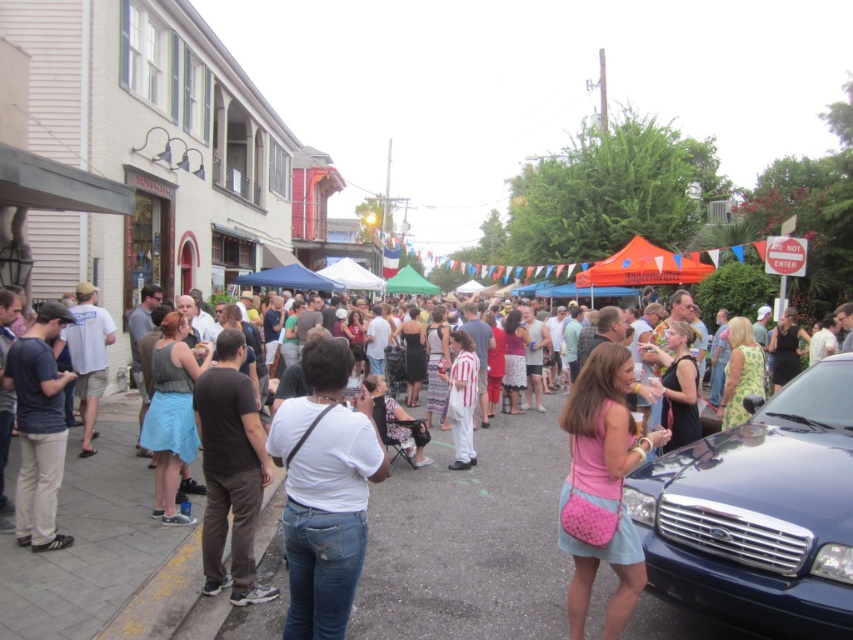
You are a pedestrian trying to cross the street from the left side where you are standing. There is a shiny blue car at lower right and a white matte shirt at center in your path. Which object is closer to you, the pedestrian, so you need to avoid it first?

The shiny blue car at lower right is closer to you than the white matte shirt at center, so you should avoid it first.

You are a photographer at the event and want to capture both the dark brown cotton pants at left and the dark blue shirt at left in a single photo. Since you can only focus on one subject, which one should you focus on to ensure both appear in focus?

You should focus on the dark brown cotton pants at left because it is closer to you than the dark blue shirt at left, ensuring both will be in focus when using a shallow depth of field.